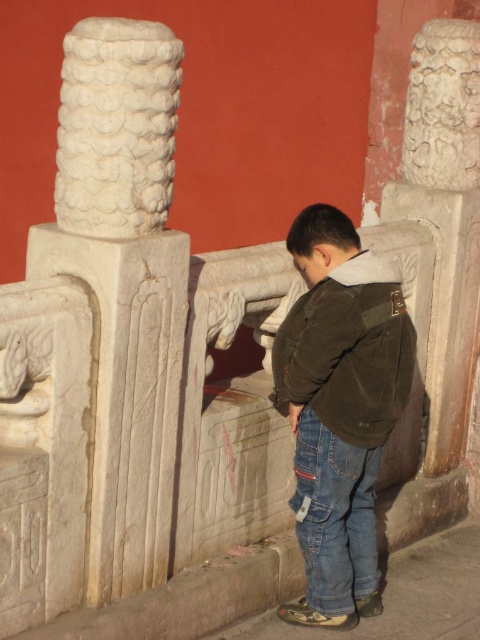
You are an architect assessing the proportions of the white stone column at upper left and the brown corduroy jacket at center in the image. Which object has a smaller width?

The white stone column at upper left has a lesser width compared to the brown corduroy jacket at center.

You are a tour guide explaining the historical site to visitors. You want to ensure visitors can touch both the dark brown corduroy jacket at center and the white stone column at center during the tour. Is there enough space between them for a visitor to comfortably reach both without moving their position?

The distance between the dark brown corduroy jacket at center and the white stone column at center is 26.17 inches. Since this allows visitors to comfortably reach both items from their current position, there is sufficient space.

Consider the image. You are a fashion designer observing a model wearing a brown corduroy jacket at center and blue denim jeans at lower center. Which clothing item is more to the right?

The brown corduroy jacket at center is positioned on the right side of the blue denim jeans at lower center, so it is more to the right.